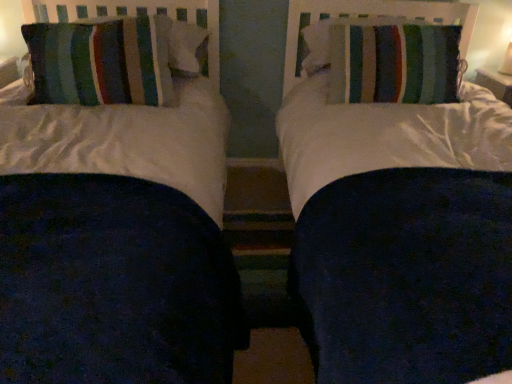
What do you see at coordinates (101, 61) in the screenshot? I see `striped fabric pillow at left, the 1th pillow viewed from the left` at bounding box center [101, 61].

Where is `striped fabric pillow at left, arranged as the second pillow when viewed from the right`? The width and height of the screenshot is (512, 384). striped fabric pillow at left, arranged as the second pillow when viewed from the right is located at coordinates (101, 61).

Measure the distance between striped fabric pillow at left, the 1th pillow viewed from the left, and camera.

striped fabric pillow at left, the 1th pillow viewed from the left, and camera are 1.60 meters apart from each other.

Based on the photo, how much space does striped fabric pillow at upper right, placed as the 1th pillow when sorted from right to left, occupy horizontally?

striped fabric pillow at upper right, placed as the 1th pillow when sorted from right to left, is 32.12 inches wide.

Where is `striped fabric pillow at upper right, placed as the 1th pillow when sorted from right to left`? Image resolution: width=512 pixels, height=384 pixels. striped fabric pillow at upper right, placed as the 1th pillow when sorted from right to left is located at coordinates (386, 60).

Describe the element at coordinates (386, 60) in the screenshot. I see `striped fabric pillow at upper right, which is the 2th pillow in left-to-right order` at that location.

In order to face striped fabric pillow at upper right, which is the 2th pillow in left-to-right order, should I rotate leftwards or rightwards?

To align with it, rotate right about 16.619°.

Locate an element on the screen. This screenshot has width=512, height=384. striped fabric pillow at left, arranged as the second pillow when viewed from the right is located at coordinates (101, 61).

Between striped fabric pillow at left, arranged as the second pillow when viewed from the right, and striped fabric pillow at upper right, which is the 2th pillow in left-to-right order, which one appears on the left side from the viewer's perspective?

Positioned to the left is striped fabric pillow at left, arranged as the second pillow when viewed from the right.

Which object is more forward, striped fabric pillow at left, arranged as the second pillow when viewed from the right, or striped fabric pillow at upper right, placed as the 1th pillow when sorted from right to left?

striped fabric pillow at left, arranged as the second pillow when viewed from the right, is more forward.

Is point (161, 69) in front of point (458, 79)?

Yes, point (161, 69) is in front of point (458, 79).

From the image's perspective, is striped fabric pillow at left, arranged as the second pillow when viewed from the right, positioned above or below striped fabric pillow at upper right, placed as the 1th pillow when sorted from right to left?

Clearly, from the image's perspective, striped fabric pillow at left, arranged as the second pillow when viewed from the right, is below striped fabric pillow at upper right, placed as the 1th pillow when sorted from right to left.

From a real-world perspective, relative to striped fabric pillow at upper right, which is the 2th pillow in left-to-right order, is striped fabric pillow at left, the 1th pillow viewed from the left, vertically above or below?

striped fabric pillow at left, the 1th pillow viewed from the left, is below striped fabric pillow at upper right, which is the 2th pillow in left-to-right order.

Considering the sizes of objects striped fabric pillow at left, arranged as the second pillow when viewed from the right, and striped fabric pillow at upper right, placed as the 1th pillow when sorted from right to left, in the image provided, who is thinner, striped fabric pillow at left, arranged as the second pillow when viewed from the right, or striped fabric pillow at upper right, placed as the 1th pillow when sorted from right to left,?

striped fabric pillow at left, arranged as the second pillow when viewed from the right.

Can you confirm if striped fabric pillow at left, arranged as the second pillow when viewed from the right, is shorter than striped fabric pillow at upper right, placed as the 1th pillow when sorted from right to left?

No, striped fabric pillow at left, arranged as the second pillow when viewed from the right, is not shorter than striped fabric pillow at upper right, placed as the 1th pillow when sorted from right to left.

Considering the relative sizes of striped fabric pillow at left, the 1th pillow viewed from the left, and striped fabric pillow at upper right, which is the 2th pillow in left-to-right order, in the image provided, is striped fabric pillow at left, the 1th pillow viewed from the left, bigger than striped fabric pillow at upper right, which is the 2th pillow in left-to-right order,?

Yes.

Is striped fabric pillow at left, the 1th pillow viewed from the left, situated inside striped fabric pillow at upper right, which is the 2th pillow in left-to-right order, or outside?

striped fabric pillow at left, the 1th pillow viewed from the left, exists outside the volume of striped fabric pillow at upper right, which is the 2th pillow in left-to-right order.

Would you say striped fabric pillow at left, the 1th pillow viewed from the left, is a long distance from striped fabric pillow at upper right, which is the 2th pillow in left-to-right order?

No.

Is striped fabric pillow at upper right, placed as the 1th pillow when sorted from right to left, at the back of striped fabric pillow at left, the 1th pillow viewed from the left?

No, striped fabric pillow at left, the 1th pillow viewed from the left, is not facing away from striped fabric pillow at upper right, placed as the 1th pillow when sorted from right to left.

Can you tell me how much striped fabric pillow at left, arranged as the second pillow when viewed from the right, and striped fabric pillow at upper right, which is the 2th pillow in left-to-right order, differ in facing direction?

The angular difference between striped fabric pillow at left, arranged as the second pillow when viewed from the right, and striped fabric pillow at upper right, which is the 2th pillow in left-to-right order, is 93.8 degrees.

How distant is striped fabric pillow at left, the 1th pillow viewed from the left, from striped fabric pillow at upper right, placed as the 1th pillow when sorted from right to left?

striped fabric pillow at left, the 1th pillow viewed from the left, is 35.43 inches away from striped fabric pillow at upper right, placed as the 1th pillow when sorted from right to left.

Image resolution: width=512 pixels, height=384 pixels. I want to click on pillow in front of the striped fabric pillow at upper right, which is the 2th pillow in left-to-right order, so click(101, 61).

Between striped fabric pillow at upper right, which is the 2th pillow in left-to-right order, and striped fabric pillow at left, the 1th pillow viewed from the left, which one appears on the right side from the viewer's perspective?

striped fabric pillow at upper right, which is the 2th pillow in left-to-right order, is more to the right.

Is the position of striped fabric pillow at upper right, placed as the 1th pillow when sorted from right to left, less distant than that of striped fabric pillow at left, arranged as the second pillow when viewed from the right?

No, it is not.

Does point (356, 27) come farther from viewer compared to point (28, 29)?

Yes, it is.

In the scene shown: From the image's perspective, between striped fabric pillow at upper right, which is the 2th pillow in left-to-right order, and striped fabric pillow at left, the 1th pillow viewed from the left, who is located below?

striped fabric pillow at left, the 1th pillow viewed from the left, appears lower in the image.

Looking at this image, from a real-world perspective, does striped fabric pillow at upper right, placed as the 1th pillow when sorted from right to left, sit lower than striped fabric pillow at left, the 1th pillow viewed from the left?

Actually, striped fabric pillow at upper right, placed as the 1th pillow when sorted from right to left, is physically above striped fabric pillow at left, the 1th pillow viewed from the left, in the real world.

Does striped fabric pillow at upper right, placed as the 1th pillow when sorted from right to left, have a lesser width compared to striped fabric pillow at left, the 1th pillow viewed from the left?

No.

Considering the sizes of objects striped fabric pillow at upper right, which is the 2th pillow in left-to-right order, and striped fabric pillow at left, the 1th pillow viewed from the left, in the image provided, who is taller, striped fabric pillow at upper right, which is the 2th pillow in left-to-right order, or striped fabric pillow at left, the 1th pillow viewed from the left,?

striped fabric pillow at left, the 1th pillow viewed from the left.

Considering the relative sizes of striped fabric pillow at upper right, which is the 2th pillow in left-to-right order, and striped fabric pillow at left, arranged as the second pillow when viewed from the right, in the image provided, is striped fabric pillow at upper right, which is the 2th pillow in left-to-right order, bigger than striped fabric pillow at left, arranged as the second pillow when viewed from the right,?

Actually, striped fabric pillow at upper right, which is the 2th pillow in left-to-right order, might be smaller than striped fabric pillow at left, arranged as the second pillow when viewed from the right.

Would you say striped fabric pillow at upper right, which is the 2th pillow in left-to-right order, contains striped fabric pillow at left, the 1th pillow viewed from the left?

No, striped fabric pillow at upper right, which is the 2th pillow in left-to-right order, does not contain striped fabric pillow at left, the 1th pillow viewed from the left.

Is striped fabric pillow at upper right, placed as the 1th pillow when sorted from right to left, far from striped fabric pillow at left, arranged as the second pillow when viewed from the right?

striped fabric pillow at upper right, placed as the 1th pillow when sorted from right to left, is actually quite close to striped fabric pillow at left, arranged as the second pillow when viewed from the right.

Is striped fabric pillow at upper right, placed as the 1th pillow when sorted from right to left, positioned with its back to striped fabric pillow at left, arranged as the second pillow when viewed from the right?

No, striped fabric pillow at left, arranged as the second pillow when viewed from the right, is not at the back of striped fabric pillow at upper right, placed as the 1th pillow when sorted from right to left.

Can you tell me how much striped fabric pillow at upper right, which is the 2th pillow in left-to-right order, and striped fabric pillow at left, the 1th pillow viewed from the left, differ in facing direction?

93.8 degrees separate the facing orientations of striped fabric pillow at upper right, which is the 2th pillow in left-to-right order, and striped fabric pillow at left, the 1th pillow viewed from the left.

The image size is (512, 384). In order to click on pillow above the striped fabric pillow at left, the 1th pillow viewed from the left (from a real-world perspective) in this screenshot , I will do `click(386, 60)`.

This screenshot has height=384, width=512. In order to click on pillow directly beneath the striped fabric pillow at upper right, which is the 2th pillow in left-to-right order (from a real-world perspective) in this screenshot , I will do `click(101, 61)`.

Where is `pillow above the striped fabric pillow at left, the 1th pillow viewed from the left (from the image's perspective)`? Image resolution: width=512 pixels, height=384 pixels. pillow above the striped fabric pillow at left, the 1th pillow viewed from the left (from the image's perspective) is located at coordinates (386, 60).